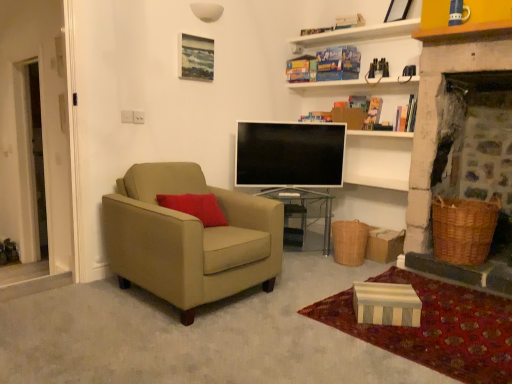
The height and width of the screenshot is (384, 512). Identify the location of free space between woven brown picnic basket at lower center, which is the 2th picnic basket in right-to-left order, and striped cardboard box at lower right. (330, 273).